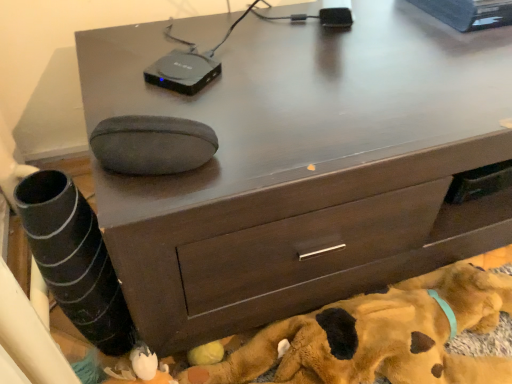
What is the approximate height of black plastic device at upper center?

The height of black plastic device at upper center is 1.02 inches.

Locate an element on the screen. black plastic device at upper center is located at coordinates 182,72.

Describe the element at coordinates (182, 72) in the screenshot. I see `black plastic device at upper center` at that location.

Measure the distance between point [432,294] and camera.

Point [432,294] is 31.42 inches from camera.

This screenshot has height=384, width=512. What do you see at coordinates (378, 338) in the screenshot?
I see `brown plush dog at lower center` at bounding box center [378, 338].

The height and width of the screenshot is (384, 512). Identify the location of brown plush dog at lower center. (378, 338).

Image resolution: width=512 pixels, height=384 pixels. I want to click on black plastic device at upper center, so click(x=182, y=72).

Considering the relative positions of brown plush dog at lower center and black plastic device at upper center in the image provided, is brown plush dog at lower center to the left or to the right of black plastic device at upper center?

Based on their positions, brown plush dog at lower center is located to the right of black plastic device at upper center.

Is the position of brown plush dog at lower center less distant than that of black plastic device at upper center?

Yes, it is in front of black plastic device at upper center.

Which is behind, point (432, 383) or point (169, 81)?

The point (169, 81) is behind.

From the image's perspective, does brown plush dog at lower center appear lower than black plastic device at upper center?

Yes.

From a real-world perspective, which is physically above, brown plush dog at lower center or black plastic device at upper center?

black plastic device at upper center.

Considering the sizes of objects brown plush dog at lower center and black plastic device at upper center in the image provided, who is wider, brown plush dog at lower center or black plastic device at upper center?

With larger width is brown plush dog at lower center.

Considering the sizes of objects brown plush dog at lower center and black plastic device at upper center in the image provided, who is shorter, brown plush dog at lower center or black plastic device at upper center?

Standing shorter between the two is black plastic device at upper center.

Considering the sizes of brown plush dog at lower center and black plastic device at upper center in the image, is brown plush dog at lower center bigger or smaller than black plastic device at upper center?

In the image, brown plush dog at lower center appears to be larger than black plastic device at upper center.

Would you say brown plush dog at lower center is inside or outside black plastic device at upper center?

brown plush dog at lower center cannot be found inside black plastic device at upper center.

Is the surface of brown plush dog at lower center in direct contact with black plastic device at upper center?

No.

Could you tell me if brown plush dog at lower center is turned towards black plastic device at upper center?

No.

In the scene shown: How many degrees apart are the facing directions of brown plush dog at lower center and black plastic device at upper center?

brown plush dog at lower center and black plastic device at upper center are facing 51.4 degrees away from each other.

Where is `gadget behind the brown plush dog at lower center`? The image size is (512, 384). gadget behind the brown plush dog at lower center is located at coordinates (182, 72).

Considering the positions of objects black plastic device at upper center and brown plush dog at lower center in the image provided, who is more to the left, black plastic device at upper center or brown plush dog at lower center?

Positioned to the left is black plastic device at upper center.

Between black plastic device at upper center and brown plush dog at lower center, which one is positioned behind?

Positioned behind is black plastic device at upper center.

Does point (184, 90) come farther from viewer compared to point (461, 356)?

No, it is not.

From the image's perspective, which is below, black plastic device at upper center or brown plush dog at lower center?

brown plush dog at lower center.

From a real-world perspective, does black plastic device at upper center stand above brown plush dog at lower center?

Yes, from a real-world perspective, black plastic device at upper center is on top of brown plush dog at lower center.

Is black plastic device at upper center thinner than brown plush dog at lower center?

Indeed, black plastic device at upper center has a lesser width compared to brown plush dog at lower center.

In terms of height, does black plastic device at upper center look taller or shorter compared to brown plush dog at lower center?

black plastic device at upper center is shorter than brown plush dog at lower center.

Does black plastic device at upper center have a larger size compared to brown plush dog at lower center?

Actually, black plastic device at upper center might be smaller than brown plush dog at lower center.

Is brown plush dog at lower center a part of black plastic device at upper center?

Definitely not — brown plush dog at lower center is not inside black plastic device at upper center.

Does black plastic device at upper center touch brown plush dog at lower center?

No, black plastic device at upper center is not with brown plush dog at lower center.

Is black plastic device at upper center facing towards brown plush dog at lower center?

No, black plastic device at upper center is not aimed at brown plush dog at lower center.

Can you tell me how much black plastic device at upper center and brown plush dog at lower center differ in facing direction?

51.4 degrees separate the facing orientations of black plastic device at upper center and brown plush dog at lower center.

Where is `dog that appears below the black plastic device at upper center (from a real-world perspective)`? dog that appears below the black plastic device at upper center (from a real-world perspective) is located at coordinates (378, 338).

In order to click on gadget on the left of brown plush dog at lower center in this screenshot , I will do point(182,72).

Identify the location of gadget lying behind the brown plush dog at lower center. (182, 72).